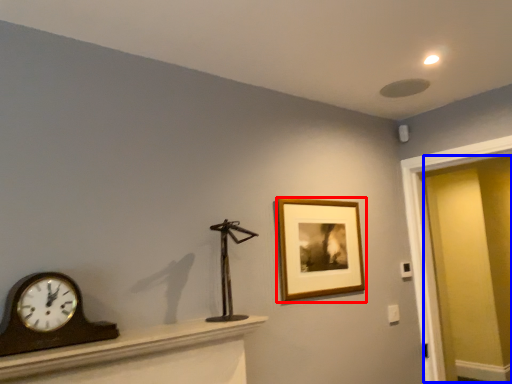
Question: Which object is further to the camera taking this photo, picture frame (highlighted by a red box) or glass door (highlighted by a blue box)?

Choices:
 (A) picture frame
 (B) glass door

Answer: (B)